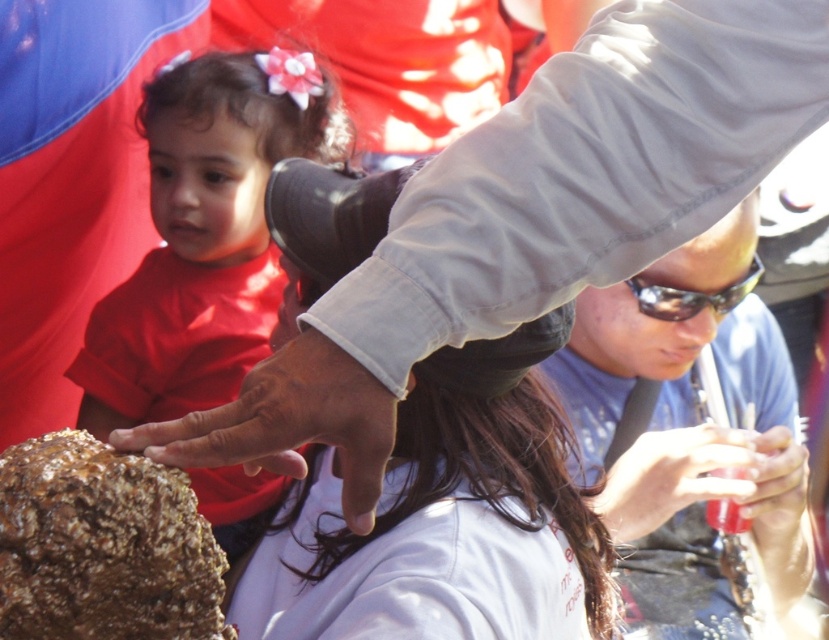
Question: Which point is closer to the camera taking this photo?

Choices:
 (A) (743, 458)
 (B) (677, 333)
 (C) (318, 410)
 (D) (573, 516)

Answer: (C)

Question: Can you confirm if brown rough hand at center is positioned above sunglasses at upper center?

Choices:
 (A) no
 (B) yes

Answer: (A)

Question: Which point is closer to the camera?

Choices:
 (A) matte red shirt at left
 (B) sunglasses at upper center

Answer: (A)

Question: Does brown rough rock at center appear over translucent plastic cup at lower right?

Choices:
 (A) no
 (B) yes

Answer: (B)

Question: Can you confirm if brown rough rock at center is positioned to the right of translucent plastic cup at lower right?

Choices:
 (A) no
 (B) yes

Answer: (A)

Question: Considering the real-world distances, which object is closest to the matte red shirt at left?

Choices:
 (A) sunglasses at center
 (B) translucent plastic cup at lower right
 (C) brown rough rock at center
 (D) smooth plastic cup at lower right

Answer: (A)